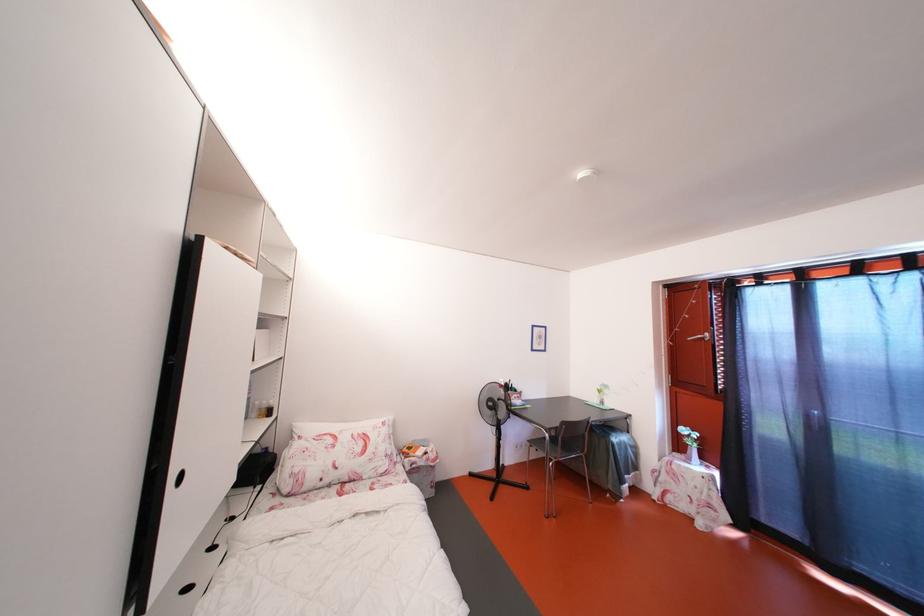
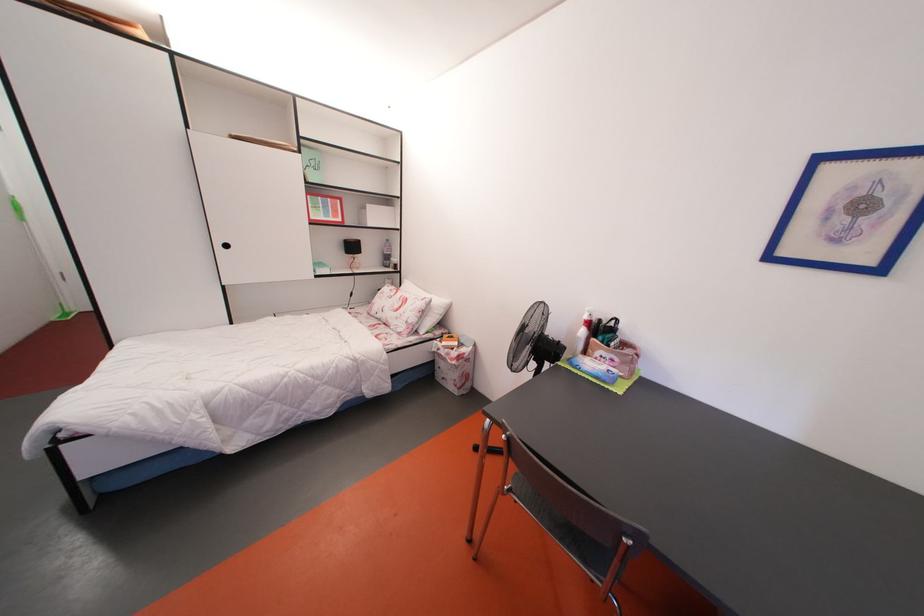
The point at (393, 461) is marked in the first image. Where is the corresponding point in the second image?

(414, 328)